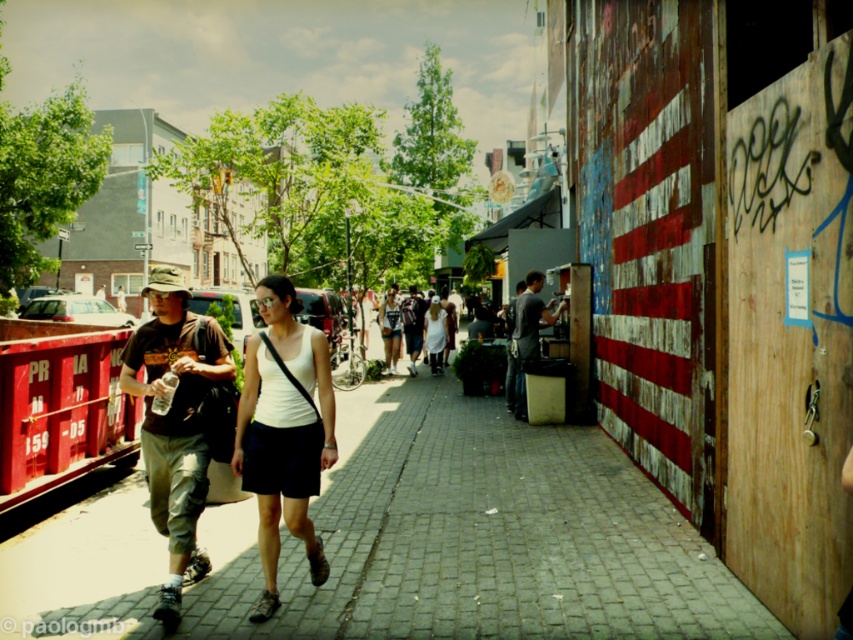
You are a photographer trying to capture a candid shot of the two people at the center of the image. The camera you are using has a focus range that can only accommodate objects up to 1.5 meters in width. Given that the dark gray shirt at center and denim shorts at center are the main subjects, will your camera be able to focus on both of them simultaneously?

The dark gray shirt at center is larger in width than the denim shorts at center. Since the total width of both subjects combined may exceed the camera focus range of 1.5 meters, it is possible that the camera cannot focus on both simultaneously. However, without knowing the exact combined width, we can only confirm that the dark gray shirt at center is wider than the denim shorts at center.

You are a photographer standing at the edge of the street. You want to take a photo that includes both the camouflage fabric hat at left and the white matte tank top at center. Given that your camera has a maximum focal length that allows capturing objects up to 10 meters apart in the same frame, will you be able to include both subjects in a single shot?

The camouflage fabric hat at left and white matte tank top at center are 13.54 meters apart from each other. Since the maximum distance your camera can capture in one frame is 10 meters, you will not be able to include both subjects in a single shot.